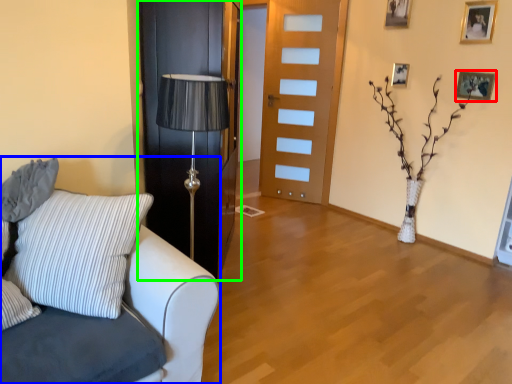
Question: Which object is the closest to the picture frame (highlighted by a red box)? Choose among these: studio couch (highlighted by a blue box) or door (highlighted by a green box).

Choices:
 (A) studio couch
 (B) door

Answer: (B)